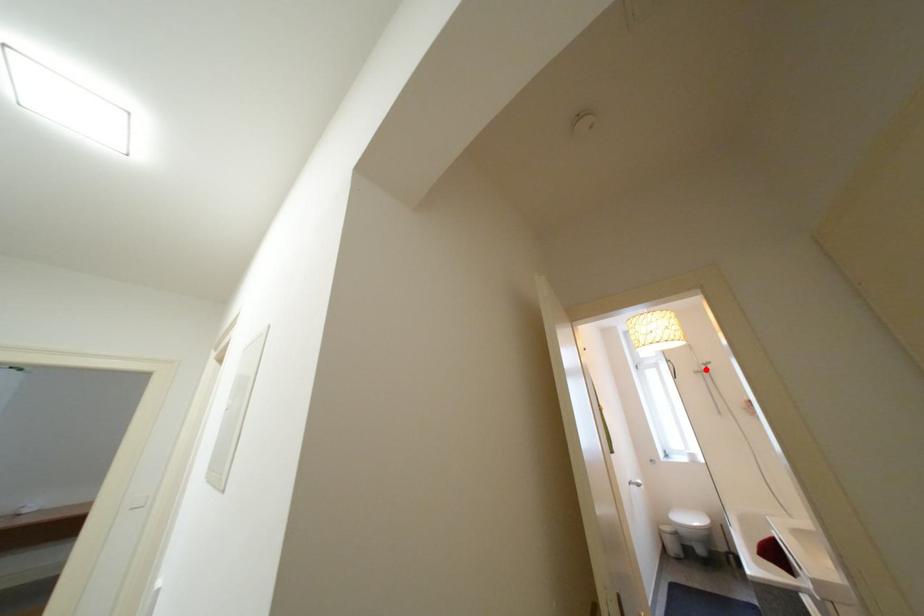
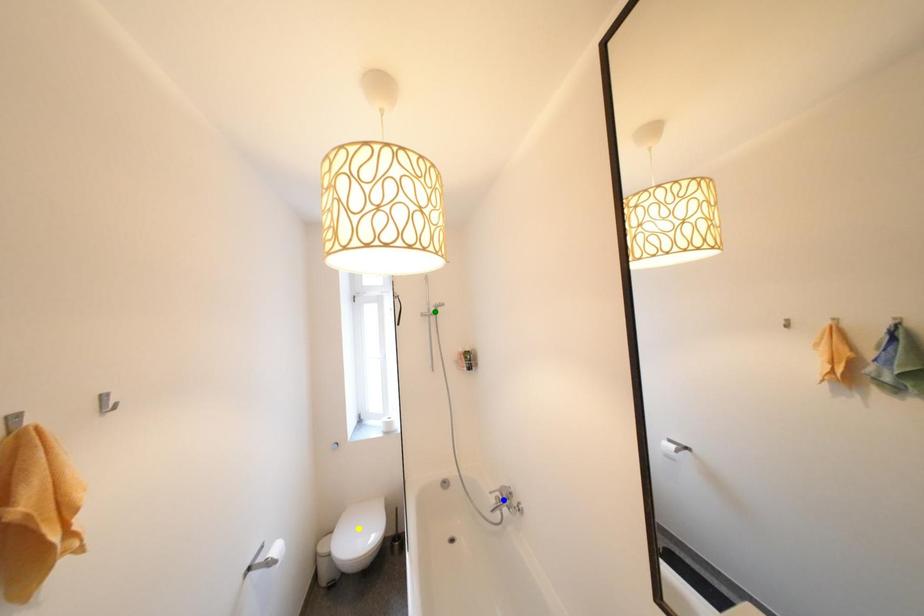
Question: I am providing you with two images of the same scene from different viewpoints. A red point is marked on the first image. You are given multiple points on the second image. Which point in image 2 represents the same 3d spot as the red point in image 1?

Choices:
 (A) blue point
 (B) yellow point
 (C) green point

Answer: (C)